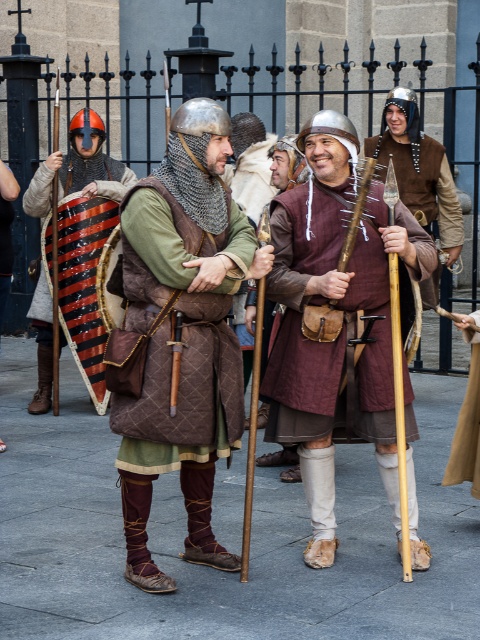
Is maroon quilted tunic at center wider than brown quilted vest at center?

Yes, maroon quilted tunic at center is wider than brown quilted vest at center.

Describe the element at coordinates (300, 316) in the screenshot. I see `maroon quilted tunic at center` at that location.

At what (x,y) coordinates should I click in order to perform the action: click on maroon quilted tunic at center. Please return your answer as a coordinate pair (x, y). The image size is (480, 640). Looking at the image, I should click on (300, 316).

Between striped leather shield at left and brown quilted vest at center, which one appears on the right side from the viewer's perspective?

brown quilted vest at center is more to the right.

Can you confirm if striped leather shield at left is smaller than brown quilted vest at center?

Correct, striped leather shield at left occupies less space than brown quilted vest at center.

Does point (110, 182) lie in front of point (419, 202)?

Yes.

What are the coordinates of `striped leather shield at left` in the screenshot? It's located at (79, 168).

Which is above, matte brown vest at center or striped leather shield at left?

striped leather shield at left

Measure the distance between point (x=187, y=193) and camera.

A distance of 5.90 meters exists between point (x=187, y=193) and camera.

Where is `matte brown vest at center`? This screenshot has width=480, height=640. matte brown vest at center is located at coordinates (182, 333).